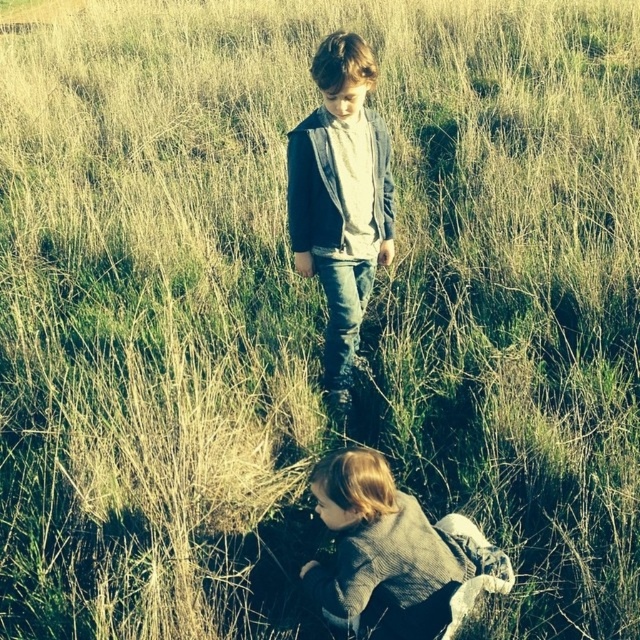
Question: From the image, what is the correct spatial relationship of denim jeans at center in relation to gray wool sweater at lower center?

Choices:
 (A) above
 (B) below

Answer: (A)

Question: Which object appears farthest from the camera in this image?

Choices:
 (A) denim jeans at center
 (B) gray wool sweater at lower center

Answer: (A)

Question: Considering the relative positions of denim jeans at center and gray wool sweater at lower center in the image provided, where is denim jeans at center located with respect to gray wool sweater at lower center?

Choices:
 (A) right
 (B) left

Answer: (B)

Question: Is denim jeans at center in front of gray wool sweater at lower center?

Choices:
 (A) no
 (B) yes

Answer: (A)

Question: Which point is closer to the camera?

Choices:
 (A) (332, 477)
 (B) (368, 161)

Answer: (A)